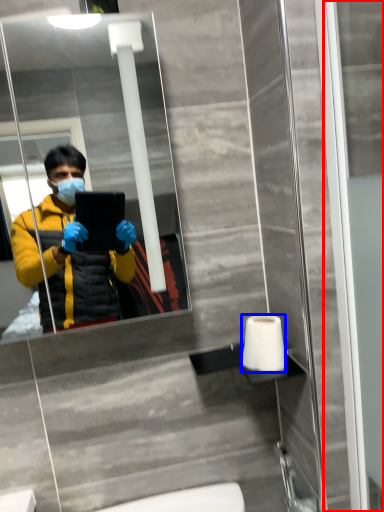
Question: Among these objects, which one is farthest to the camera, screen door (highlighted by a red box) or toilet paper (highlighted by a blue box)?

Choices:
 (A) screen door
 (B) toilet paper

Answer: (B)